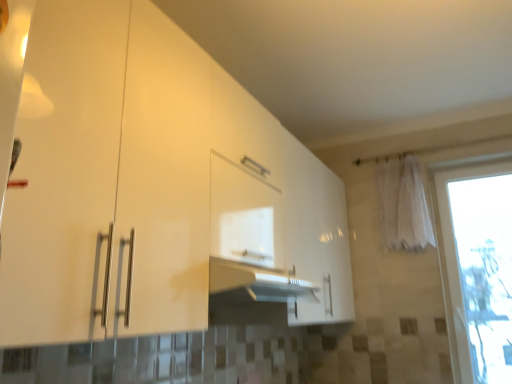
Question: Is transparent glass window at right positioned behind white fabric curtain at upper right?

Choices:
 (A) no
 (B) yes

Answer: (A)

Question: Can you confirm if transparent glass window at right is smaller than white fabric curtain at upper right?

Choices:
 (A) yes
 (B) no

Answer: (B)

Question: Is transparent glass window at right to the left of white fabric curtain at upper right from the viewer's perspective?

Choices:
 (A) yes
 (B) no

Answer: (B)

Question: Considering the relative sizes of transparent glass window at right and white fabric curtain at upper right in the image provided, is transparent glass window at right taller than white fabric curtain at upper right?

Choices:
 (A) yes
 (B) no

Answer: (A)

Question: Is transparent glass window at right at the right side of white fabric curtain at upper right?

Choices:
 (A) no
 (B) yes

Answer: (B)

Question: Considering the positions of transparent glass window at right and white glossy cabinet at center in the image, is transparent glass window at right taller or shorter than white glossy cabinet at center?

Choices:
 (A) tall
 (B) short

Answer: (A)

Question: Is transparent glass window at right spatially inside white glossy cabinet at center, or outside of it?

Choices:
 (A) outside
 (B) inside

Answer: (A)

Question: Is transparent glass window at right wider or thinner than white glossy cabinet at center?

Choices:
 (A) wide
 (B) thin

Answer: (B)

Question: Is point (478, 225) positioned closer to the camera than point (239, 264)?

Choices:
 (A) farther
 (B) closer

Answer: (A)

Question: Is white glossy cabinet at center wider or thinner than transparent glass window at right?

Choices:
 (A) wide
 (B) thin

Answer: (A)

Question: Relative to transparent glass window at right, is white glossy cabinet at center in front or behind?

Choices:
 (A) front
 (B) behind

Answer: (A)

Question: Is point (194, 157) positioned closer to the camera than point (479, 329)?

Choices:
 (A) closer
 (B) farther

Answer: (A)

Question: From the image's perspective, is white glossy cabinet at center above or below transparent glass window at right?

Choices:
 (A) above
 (B) below

Answer: (A)

Question: From a real-world perspective, is white fabric curtain at upper right above or below white glossy cabinet at center?

Choices:
 (A) above
 (B) below

Answer: (A)

Question: In terms of height, does white fabric curtain at upper right look taller or shorter compared to white glossy cabinet at center?

Choices:
 (A) tall
 (B) short

Answer: (B)